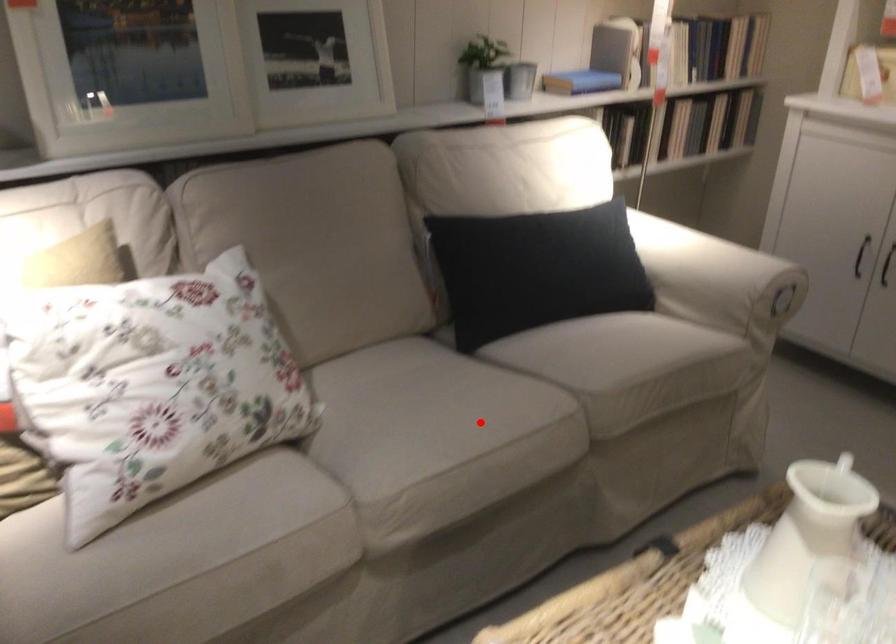
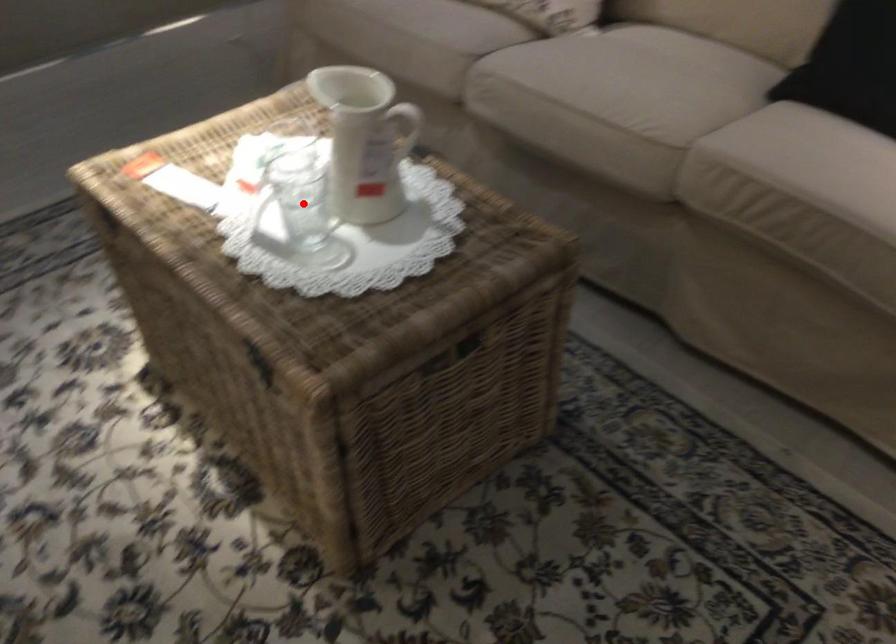
I am providing you with two images of the same scene from different viewpoints. A red point is marked on the first image and another point is marked on the second image. Are the points marked in image1 and image2 representing the same 3D position?

No